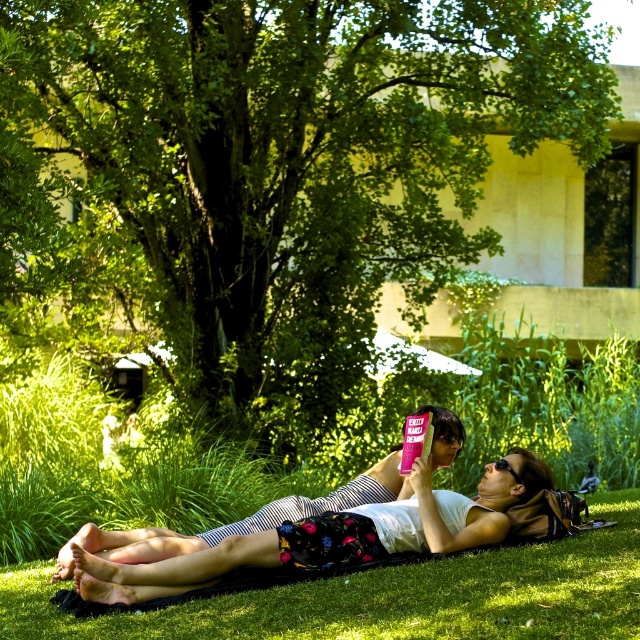
You are planning to set up a picnic under the green leafy tree at center. Considering the white cotton tank top at center is already there, where should you place your picnic basket to ensure it stays in the shade?

Place the picnic basket under the green leafy tree at center since it is positioned over the white cotton tank top at center, indicating that the tree provides shade over that area.

You are standing at the edge of the grassy area and want to lie down on the green grass at lower center. Which direction should you walk to get there from the green leafy tree at center?

You should walk downward towards the green grass at lower center since it is located below the green leafy tree at center.